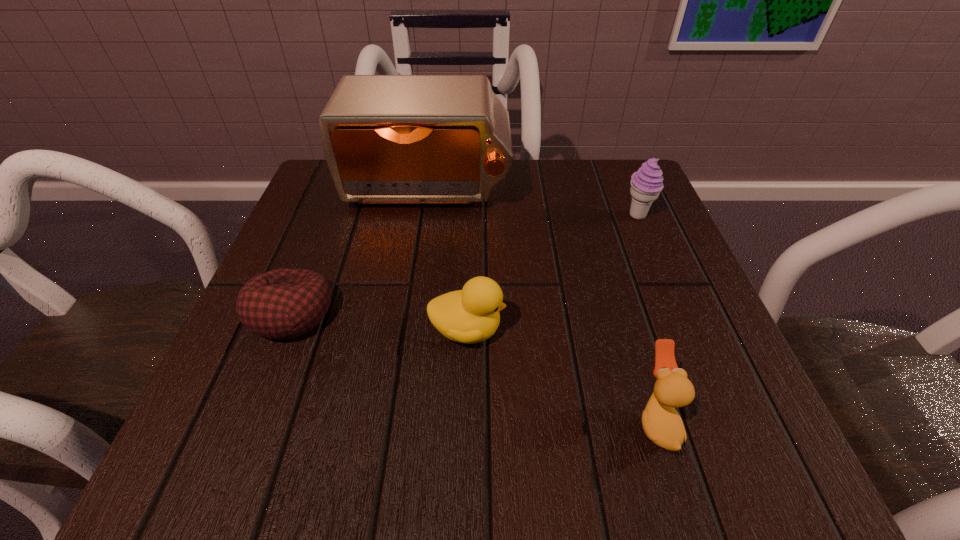
Where is `vacant area that lies between the shortest object and the right duck`? The width and height of the screenshot is (960, 540). vacant area that lies between the shortest object and the right duck is located at coordinates (x=473, y=367).

Identify which object is the nearest to the fourth object from left to right. Please provide its 2D coordinates. Your answer should be formatted as a tuple, i.e. [(x, y)], where the tuple contains the x and y coordinates of a point satisfying the conditions above.

[(471, 315)]

Choose which object is the nearest neighbor to the shortest object. Please provide its 2D coordinates. Your answer should be formatted as a tuple, i.e. [(x, y)], where the tuple contains the x and y coordinates of a point satisfying the conditions above.

[(471, 315)]

Where is `vacant point that satisfies the following two spatial constraints: 1. on the door side of the tallest object; 2. on the right side of the rightmost object`? The image size is (960, 540). vacant point that satisfies the following two spatial constraints: 1. on the door side of the tallest object; 2. on the right side of the rightmost object is located at coordinates (423, 215).